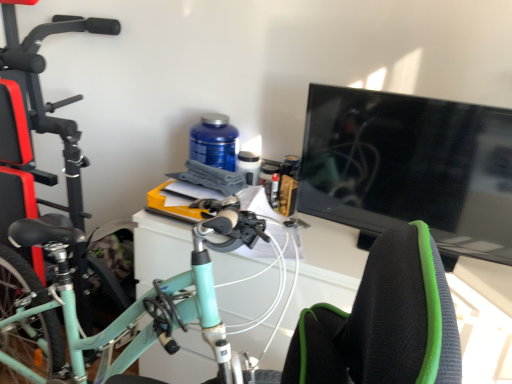
Question: From a real-world perspective, relative to black glossy tv at right, is white glossy computer desk at center vertically above or below?

Choices:
 (A) above
 (B) below

Answer: (B)

Question: Is white glossy computer desk at center inside the boundaries of black glossy tv at right, or outside?

Choices:
 (A) inside
 (B) outside

Answer: (B)

Question: Considering the real-world distances, which object is closest to the black glossy tv at right?

Choices:
 (A) white glossy computer desk at center
 (B) blue plastic bottle at center
 (C) mint green matte bicycle at left

Answer: (A)

Question: Based on their relative distances, which object is farther from the mint green matte bicycle at left?

Choices:
 (A) blue plastic bottle at center
 (B) black glossy tv at right
 (C) white glossy computer desk at center

Answer: (B)